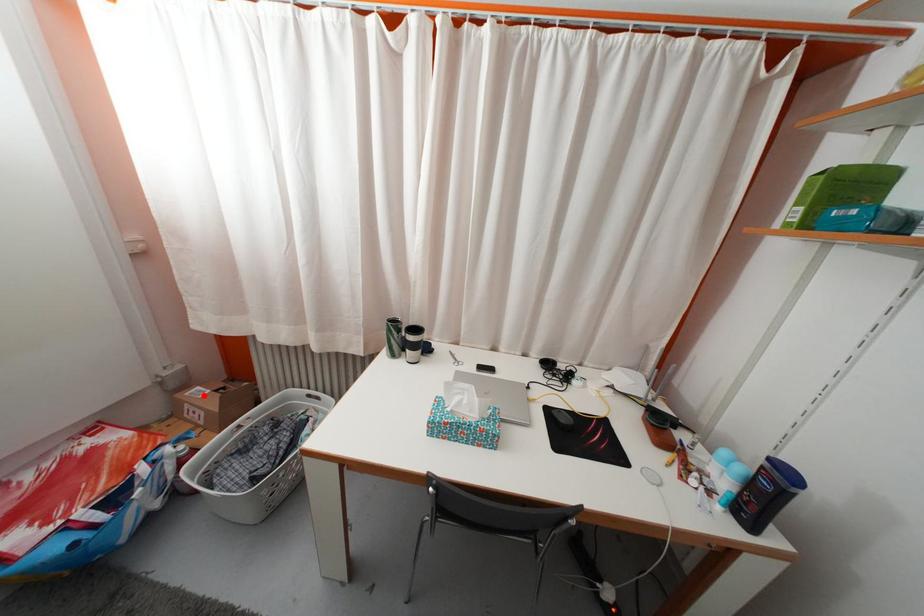
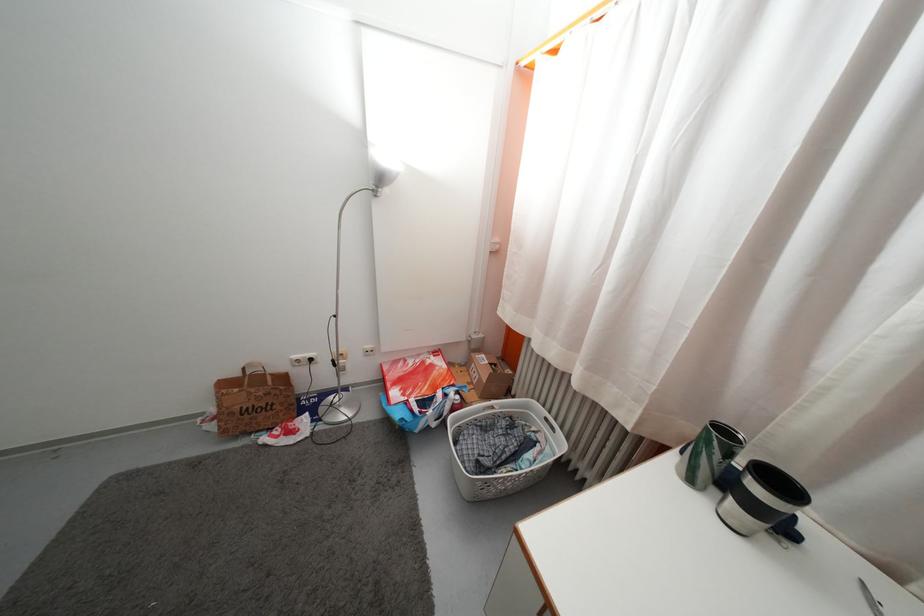
The point at the highlighted location is marked in the first image. Where is the corresponding point in the second image?

(489, 363)